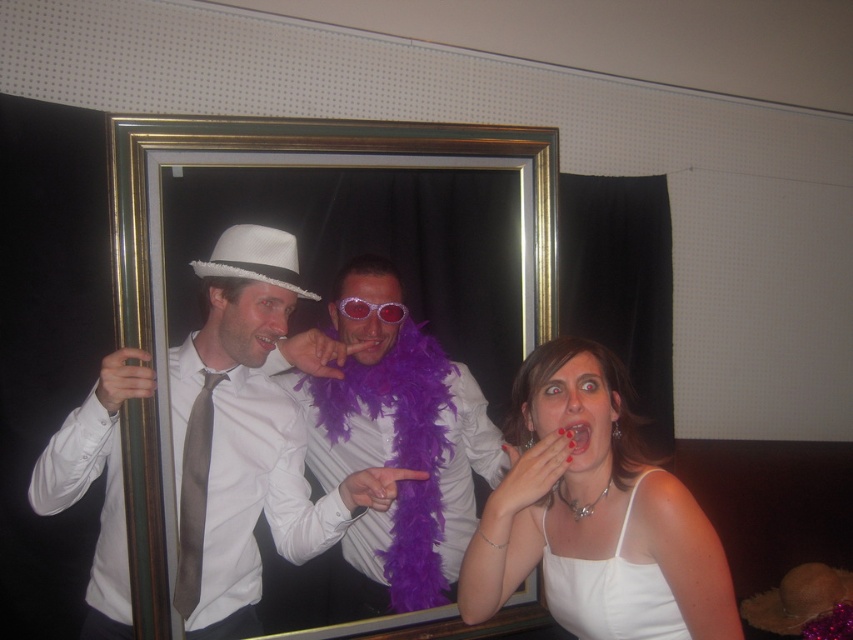
Question: Does gold/glossy picture frame at center have a lesser width compared to satin gray tie at left?

Choices:
 (A) no
 (B) yes

Answer: (A)

Question: Does purple feather boa at center appear on the right side of satin gray tie at left?

Choices:
 (A) no
 (B) yes

Answer: (B)

Question: Which point appears farthest from the camera in this image?

Choices:
 (A) (321, 401)
 (B) (581, 429)
 (C) (347, 300)
 (D) (83, 403)

Answer: (A)

Question: Which is nearer to the satin gray tie at left?

Choices:
 (A) matte white hat at center
 (B) glossy pink lips at center
 (C) gold/glossy picture frame at center
 (D) white satin tank top at lower right

Answer: (A)

Question: Which object is closer to the camera taking this photo?

Choices:
 (A) glossy pink lips at center
 (B) satin gray tie at left
 (C) translucent plastic sunglasses at center
 (D) purple feather boa at center

Answer: (A)

Question: Observing the image, what is the correct spatial positioning of purple feather boa at center in reference to glossy pink lips at center?

Choices:
 (A) below
 (B) above

Answer: (A)